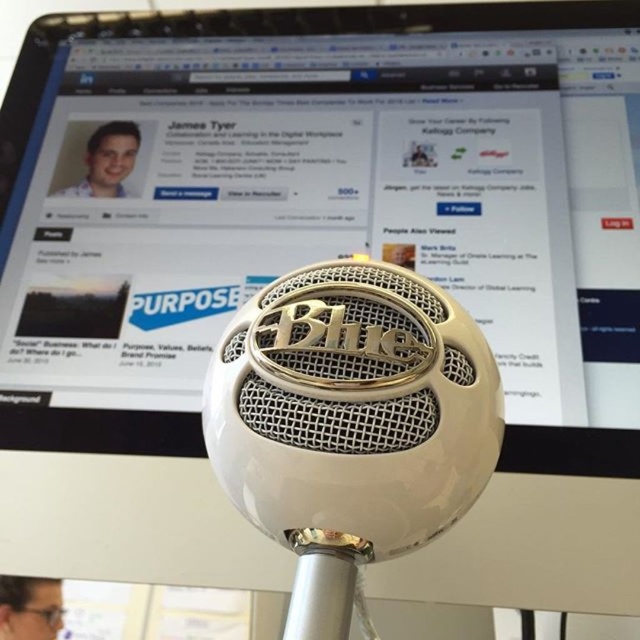
You are a photographer standing 36 inches away from the Blue Microphones microphone. You want to take a photo of the matte black glasses at lower left without moving your position. Is the glasses within your reach to focus on?

The matte black glasses at lower left is 36.76 inches away from the viewer. Since you are standing 36 inches away from the Blue Microphones microphone, the distance to the glasses is slightly further than your current position. Therefore, you might need to adjust your focus or move closer to capture a clear image of the matte black glasses at lower left.

You are standing in front of the Blue Microphones microphone setup. There is a point marked at coordinates (573, 422). If you want to place a 10 cm wide sticker exactly at that point, will there be enough space around it to avoid overlapping with other objects in the scene?

The point at (573, 422) is 98.17 centimeters away from the viewer. Since the sticker is only 10 cm wide, there should be sufficient space around the point to place it without overlapping other objects, assuming the area is clear.